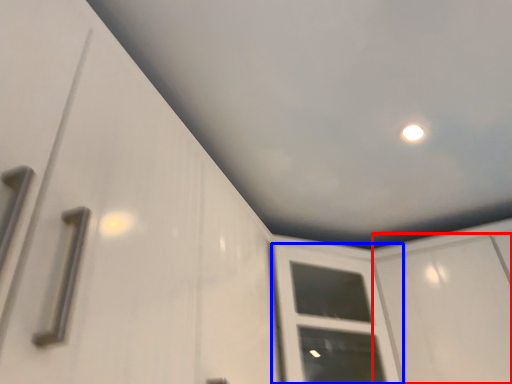
Question: Among these objects, which one is nearest to the camera, screen door (highlighted by a red box) or window frame (highlighted by a blue box)?

Choices:
 (A) screen door
 (B) window frame

Answer: (A)